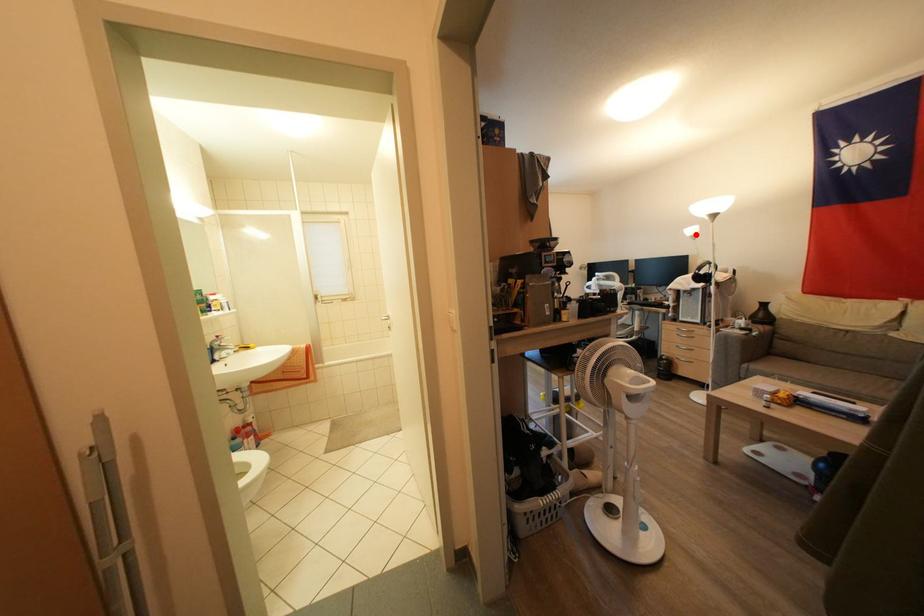
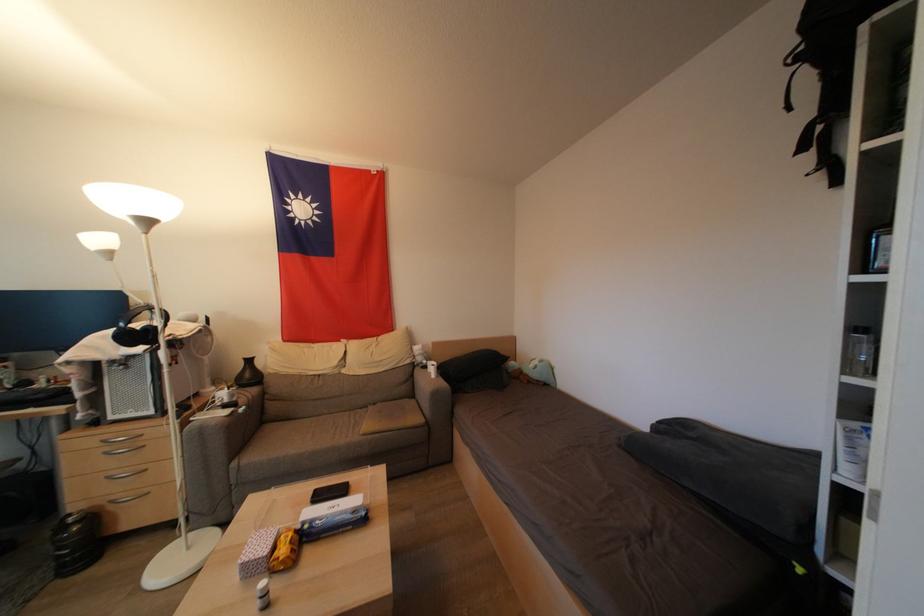
The point at the highlighted location is marked in the first image. Where is the corresponding point in the second image?

(104, 244)